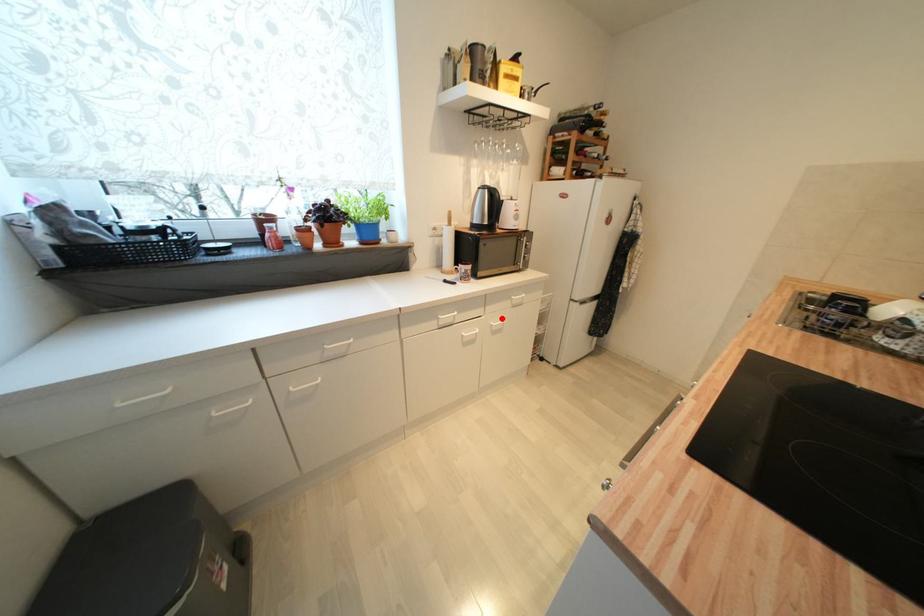
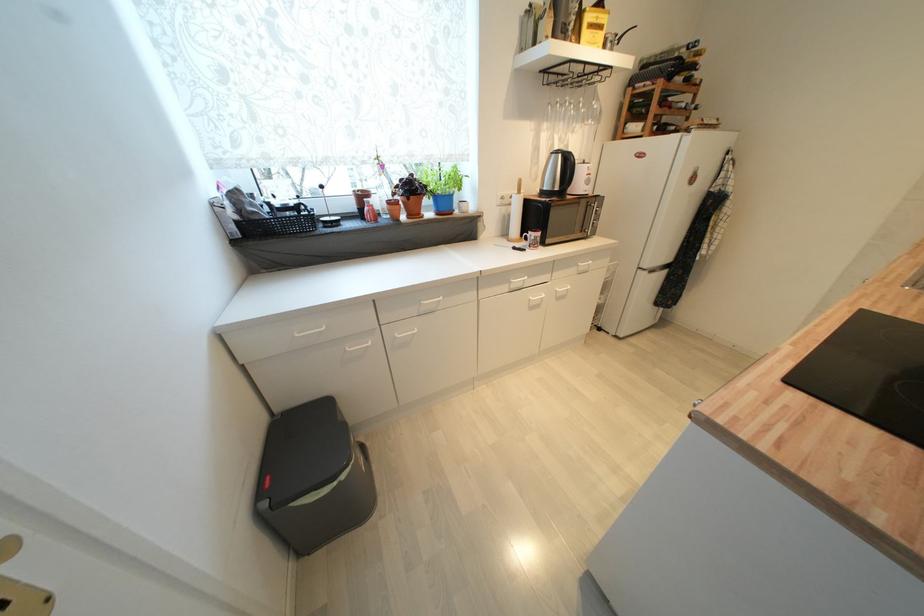
In the second image, find the point that corresponds to the highlighted location in the first image.

(566, 285)